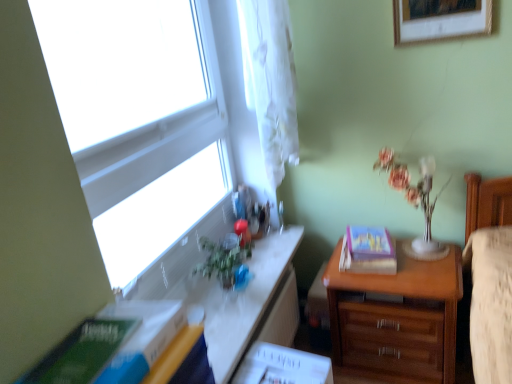
Find the location of a particular element. unoccupied region to the right of hardcover book at right, which is the second paperback book in front-to-back order is located at coordinates (420, 251).